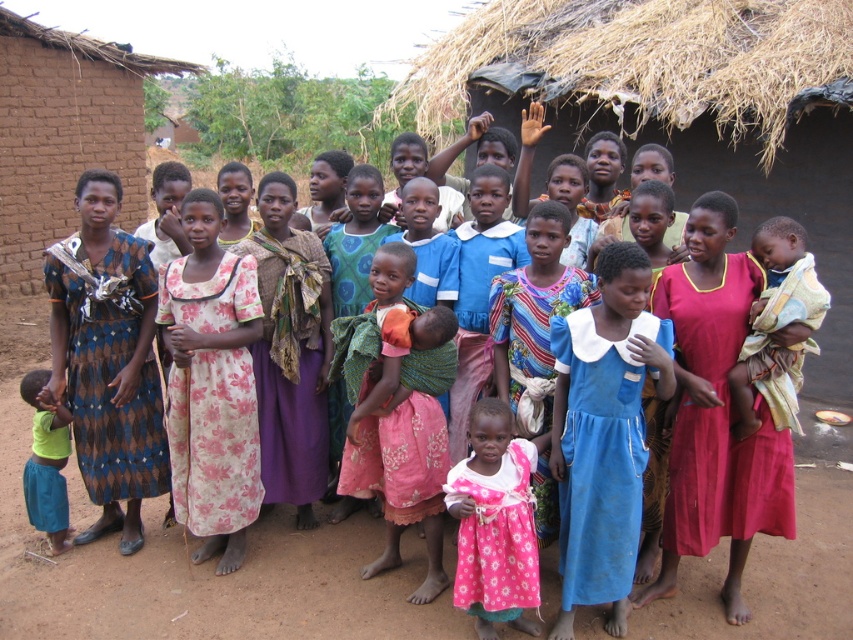
Question: Does pink floral dress at center have a smaller size compared to green fabric shirt at lower left?

Choices:
 (A) no
 (B) yes

Answer: (A)

Question: Which point is farther to the camera?

Choices:
 (A) (45, 406)
 (B) (137, 385)
 (C) (453, 595)
 (D) (601, 403)

Answer: (B)

Question: Does blue cotton dress at center have a smaller size compared to blue and brown diamond-patterned dress at left?

Choices:
 (A) no
 (B) yes

Answer: (B)

Question: Which is farther from the green fabric shirt at lower left?

Choices:
 (A) blue cotton dress at center
 (B) pink floral dress at center
 (C) floral cotton dress at center
 (D) purple textured dress at center

Answer: (A)

Question: Which object appears closest to the camera in this image?

Choices:
 (A) blue cotton dress at center
 (B) purple textured dress at center

Answer: (A)

Question: Does purple textured dress at center appear over green fabric shirt at lower left?

Choices:
 (A) yes
 (B) no

Answer: (A)